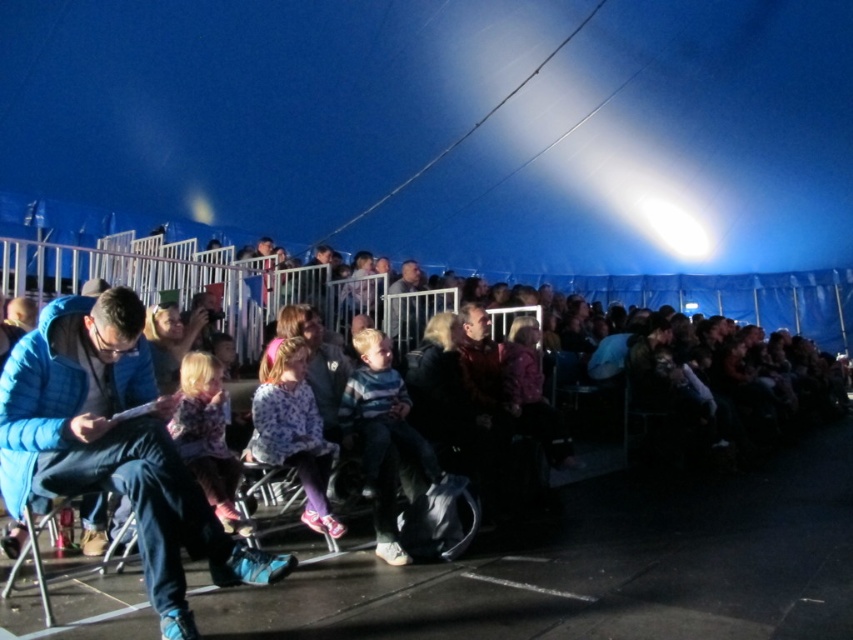
Where is `matte blue jacket at center`? This screenshot has height=640, width=853. matte blue jacket at center is located at coordinates (590, 552).

Which is more to the left, matte blue jacket at center or fluffy pink dress at center?

fluffy pink dress at center is more to the left.

Where is `matte blue jacket at center`? matte blue jacket at center is located at coordinates click(x=590, y=552).

This screenshot has height=640, width=853. What are the coordinates of `matte blue jacket at center` in the screenshot? It's located at (590, 552).

Who is higher up, matte blue jacket at center or floral sweater at center?

floral sweater at center

Does matte blue jacket at center have a smaller size compared to floral sweater at center?

No, matte blue jacket at center is not smaller than floral sweater at center.

Describe the element at coordinates (590, 552) in the screenshot. I see `matte blue jacket at center` at that location.

At what (x,y) coordinates should I click in order to perform the action: click on matte blue jacket at center. Please return your answer as a coordinate pair (x, y). Looking at the image, I should click on (590, 552).

How distant is blue quilted jacket at left from floral sweater at center?

blue quilted jacket at left is 33.99 inches from floral sweater at center.

Is blue quilted jacket at left thinner than floral sweater at center?

In fact, blue quilted jacket at left might be wider than floral sweater at center.

Is point (35, 372) positioned after point (285, 428)?

No, it is not.

Where is `blue quilted jacket at left`? blue quilted jacket at left is located at coordinates (113, 445).